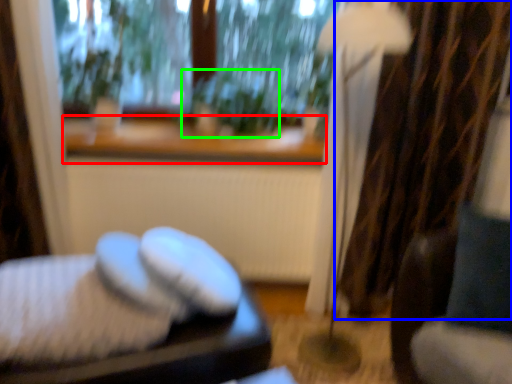
Question: Which is nearer to the window sill (highlighted by a red box)? curtain (highlighted by a blue box) or plant (highlighted by a green box).

Choices:
 (A) curtain
 (B) plant

Answer: (B)